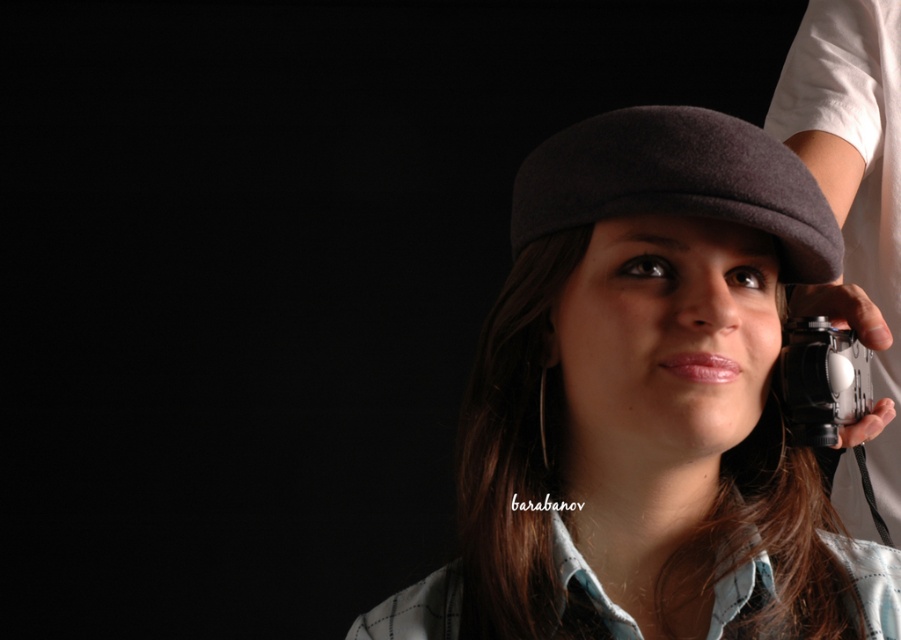
You are a photographer setting up for a portrait. You see the dark woolen hat at center and the black matte camera at right in the frame. Which object is shorter in height?

The dark woolen hat at center is shorter in height compared to the black matte camera at right.

You are a photographer setting up for a portrait session. You have a dark woolen hat at center and a black matte camera at right. Which object is smaller in size?

The dark woolen hat at center has a smaller size compared to the black matte camera at right, so the dark woolen hat at center is smaller.